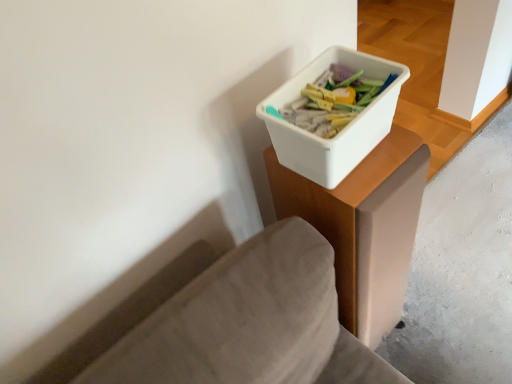
Question: Is white plastic container at upper right not close to white plastic container at upper right?

Choices:
 (A) yes
 (B) no

Answer: (B)

Question: Is white plastic container at upper right oriented towards white plastic container at upper right?

Choices:
 (A) no
 (B) yes

Answer: (A)

Question: Is white plastic container at upper right thinner than white plastic container at upper right?

Choices:
 (A) no
 (B) yes

Answer: (B)

Question: Does white plastic container at upper right lie behind white plastic container at upper right?

Choices:
 (A) yes
 (B) no

Answer: (B)

Question: Is white plastic container at upper right oriented away from white plastic container at upper right?

Choices:
 (A) no
 (B) yes

Answer: (A)

Question: Is white plastic container at upper right inside or outside of white plastic container at upper right?

Choices:
 (A) outside
 (B) inside

Answer: (A)

Question: In terms of height, does white plastic container at upper right look taller or shorter compared to white plastic container at upper right?

Choices:
 (A) short
 (B) tall

Answer: (B)

Question: Is white plastic container at upper right to the left or to the right of white plastic container at upper right in the image?

Choices:
 (A) left
 (B) right

Answer: (B)

Question: Is white plastic container at upper right in front of or behind white plastic container at upper right in the image?

Choices:
 (A) front
 (B) behind

Answer: (B)

Question: From a real-world perspective, relative to white plastic container at upper right, is smooth concrete at lower right vertically above or below?

Choices:
 (A) below
 (B) above

Answer: (A)

Question: In terms of width, does smooth concrete at lower right look wider or thinner when compared to white plastic container at upper right?

Choices:
 (A) thin
 (B) wide

Answer: (B)

Question: In terms of size, does smooth concrete at lower right appear bigger or smaller than white plastic container at upper right?

Choices:
 (A) big
 (B) small

Answer: (A)

Question: Would you say smooth concrete at lower right is to the left or to the right of white plastic container at upper right in the picture?

Choices:
 (A) right
 (B) left

Answer: (A)

Question: From a real-world perspective, relative to white plastic container at upper right, is smooth concrete at lower right vertically above or below?

Choices:
 (A) above
 (B) below

Answer: (B)

Question: From the image's perspective, is smooth concrete at lower right above or below white plastic container at upper right?

Choices:
 (A) below
 (B) above

Answer: (B)